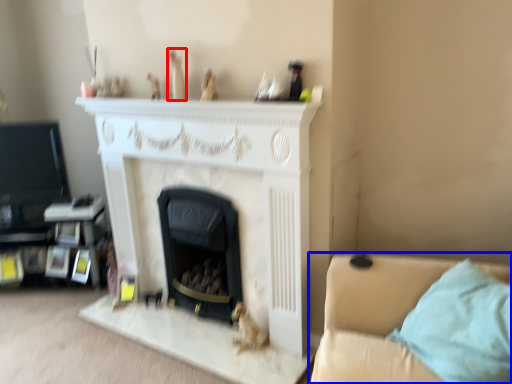
Question: Which object is closer to the camera taking this photo, toy (highlighted by a red box) or studio couch (highlighted by a blue box)?

Choices:
 (A) toy
 (B) studio couch

Answer: (B)